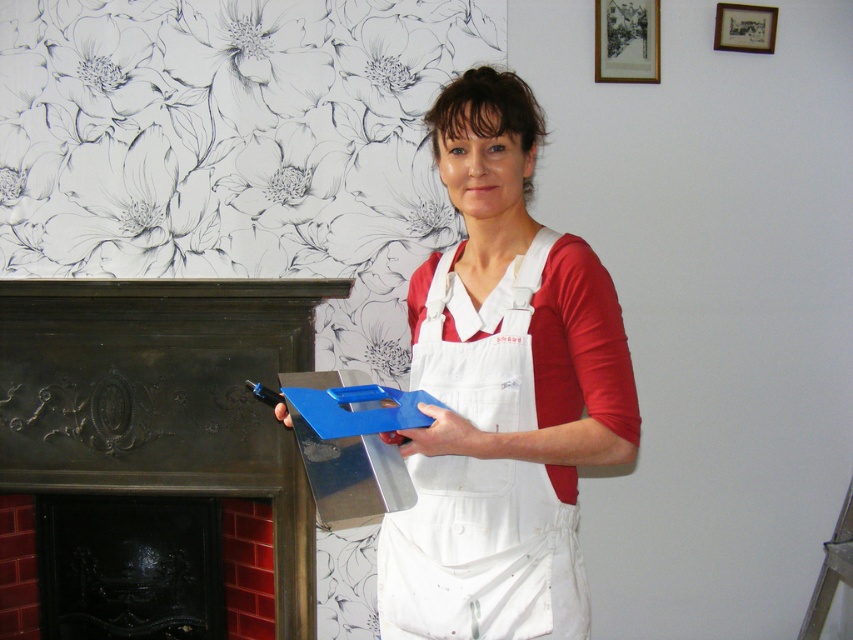
Question: Is white cotton apron at center to the right of dark brown polished wood fireplace at left from the viewer's perspective?

Choices:
 (A) yes
 (B) no

Answer: (A)

Question: Which is farther from the blue plastic trowel at center?

Choices:
 (A) white cotton apron at center
 (B) dark brown polished wood fireplace at left

Answer: (B)

Question: Is the position of dark brown polished wood fireplace at left less distant than that of blue plastic trowel at center?

Choices:
 (A) yes
 (B) no

Answer: (B)

Question: Is white cotton apron at center smaller than dark brown polished wood fireplace at left?

Choices:
 (A) no
 (B) yes

Answer: (B)

Question: Which object is the farthest from the blue plastic trowel at center?

Choices:
 (A) dark brown polished wood fireplace at left
 (B) white cotton apron at center

Answer: (A)

Question: Which of the following is the closest to the observer?

Choices:
 (A) (550, 403)
 (B) (142, 396)
 (C) (401, 390)

Answer: (A)